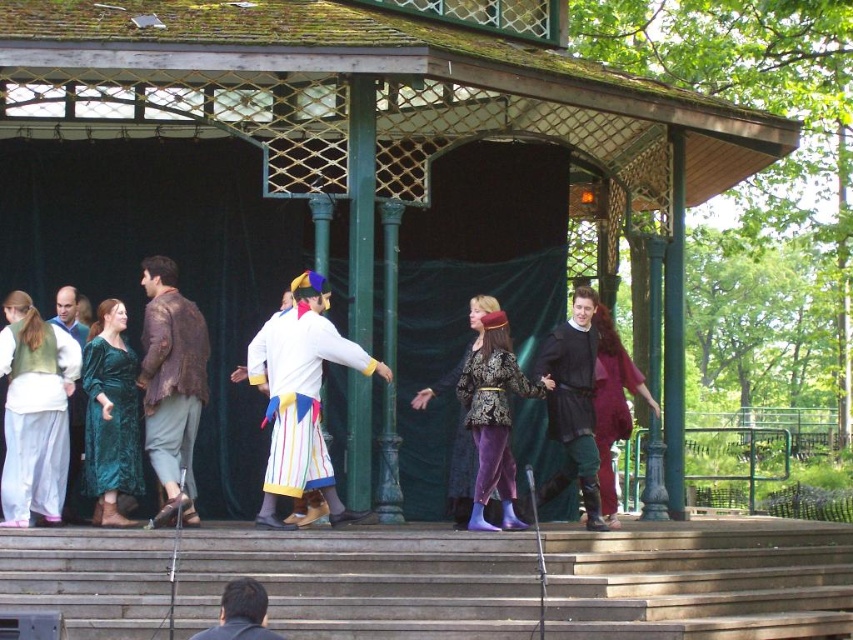
You are a stagehand preparing to set up equipment for a performance. You need to place a piece of equipment that requires a minimum of 40 meters of space from the camera to ensure proper visibility. Is the wooden stairs at center positioned far enough away to meet this requirement?

The wooden stairs at center is 40.87 meters away from camera, which exceeds the required 40 meters, so it is positioned far enough away to meet the requirement.